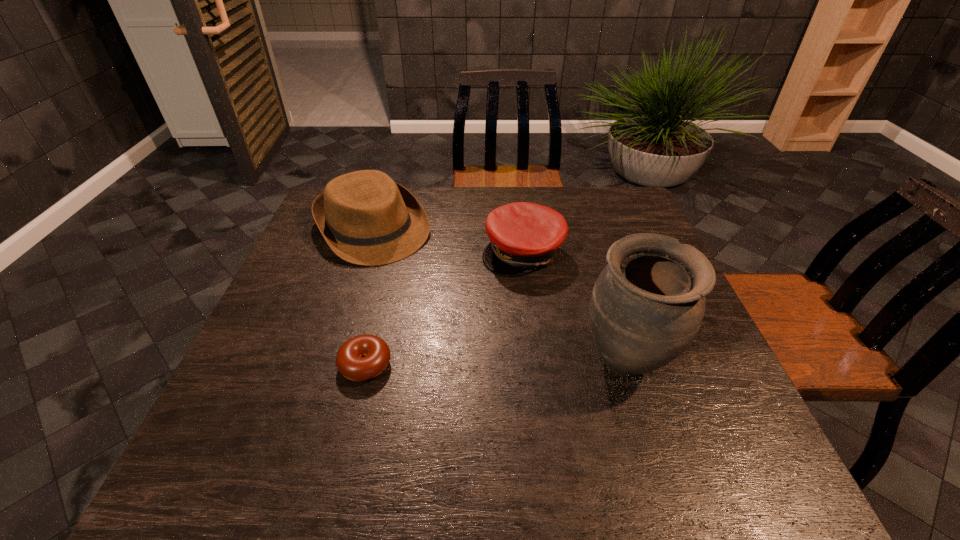
You are a GUI agent. You are given a task and a screenshot of the screen. Output one action in this format:
    pyautogui.click(x=<x>, y=<y>)
    Task: Click on the doughnut
    The image size is (960, 540).
    Given the screenshot: What is the action you would take?
    pyautogui.click(x=363, y=357)

Where is `urn`? This screenshot has width=960, height=540. urn is located at coordinates (647, 305).

The height and width of the screenshot is (540, 960). Identify the location of the third tallest object. (524, 236).

You are a GUI agent. You are given a task and a screenshot of the screen. Output one action in this format:
    pyautogui.click(x=<x>, y=<y>)
    Task: Click on the fedora
    
    Given the screenshot: What is the action you would take?
    pyautogui.click(x=366, y=218)

Locate an element on the screen. The width and height of the screenshot is (960, 540). vacant space located on the back of the shortest object is located at coordinates (389, 267).

The image size is (960, 540). I want to click on free space located on the left of the urn, so pos(444,363).

Identify the location of vacant space located 0.170m on the front-facing side of the second shortest object. (524, 326).

You are a GUI agent. You are given a task and a screenshot of the screen. Output one action in this format:
    pyautogui.click(x=<x>, y=<y>)
    Task: Click on the free space located on the front-facing side of the second shortest object
    
    Given the screenshot: What is the action you would take?
    pyautogui.click(x=525, y=405)

This screenshot has width=960, height=540. Identify the location of free space located 0.050m on the front-facing side of the second shortest object. (523, 291).

The height and width of the screenshot is (540, 960). In order to click on vacant area situated 0.390m on the front-facing side of the second tallest object in this screenshot , I will do `click(471, 355)`.